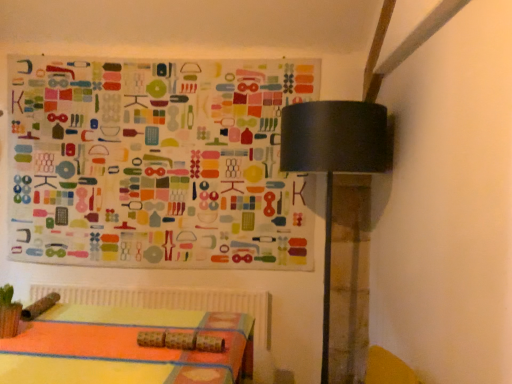
Where is `free space above multicolored fabric at upper left (from a real-world perspective)`? This screenshot has height=384, width=512. free space above multicolored fabric at upper left (from a real-world perspective) is located at coordinates (154, 56).